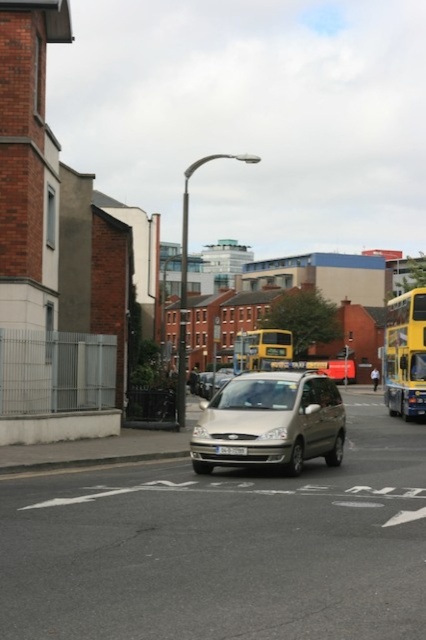
You are standing on the sidewalk next to the brick building and want to cross the street. There are two points marked on the road where you can cross. The first point is at coordinate point[224,416] and the second point is at coordinate point[216,452]. Which point is closer to you?

Point[224,416] is closer to you because it is further to the viewer than point[216,452], meaning it is nearer in the scene.